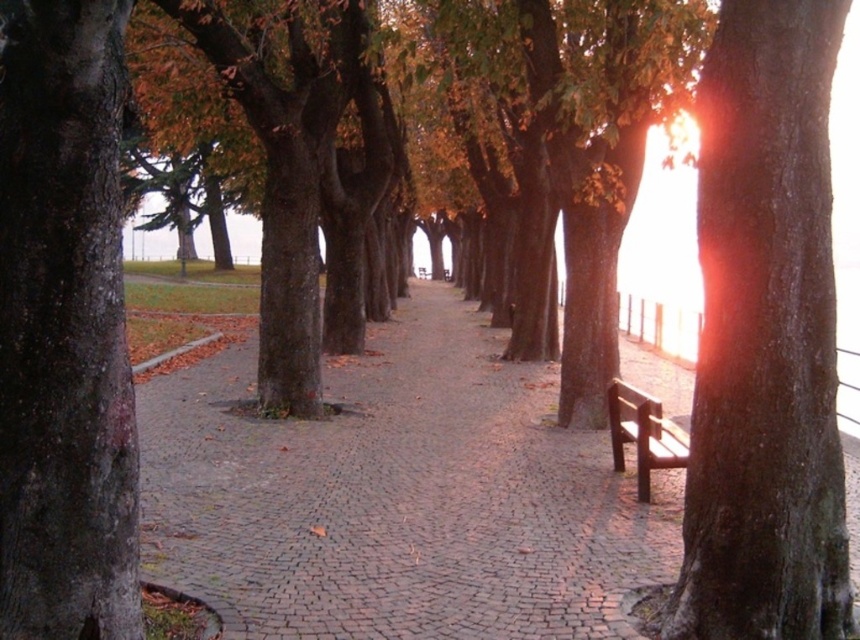
Between cobblestone pavement at center and smooth brown bark at right, which one is positioned lower?

Positioned lower is cobblestone pavement at center.

Is cobblestone pavement at center thinner than smooth brown bark at right?

No, cobblestone pavement at center is not thinner than smooth brown bark at right.

This screenshot has height=640, width=860. What do you see at coordinates (398, 497) in the screenshot? I see `cobblestone pavement at center` at bounding box center [398, 497].

Image resolution: width=860 pixels, height=640 pixels. In order to click on cobblestone pavement at center in this screenshot , I will do `click(398, 497)`.

Who is shorter, smooth brown bark at right or brown wooden bench at right?

brown wooden bench at right is shorter.

Is point (754, 604) behind point (634, 440)?

No.

Is point (745, 348) farther from viewer compared to point (634, 422)?

No, it is in front of (634, 422).

At what (x,y) coordinates should I click in order to perform the action: click on smooth brown bark at right. Please return your answer as a coordinate pair (x, y). The height and width of the screenshot is (640, 860). Looking at the image, I should click on (765, 339).

Between cobblestone pavement at center and brown wooden bench at right, which one appears on the left side from the viewer's perspective?

cobblestone pavement at center

Does cobblestone pavement at center lie in front of brown wooden bench at right?

That is True.

Does point (359, 461) come behind point (637, 483)?

Yes, point (359, 461) is farther from viewer.

Locate an element on the screen. The width and height of the screenshot is (860, 640). cobblestone pavement at center is located at coordinates (398, 497).